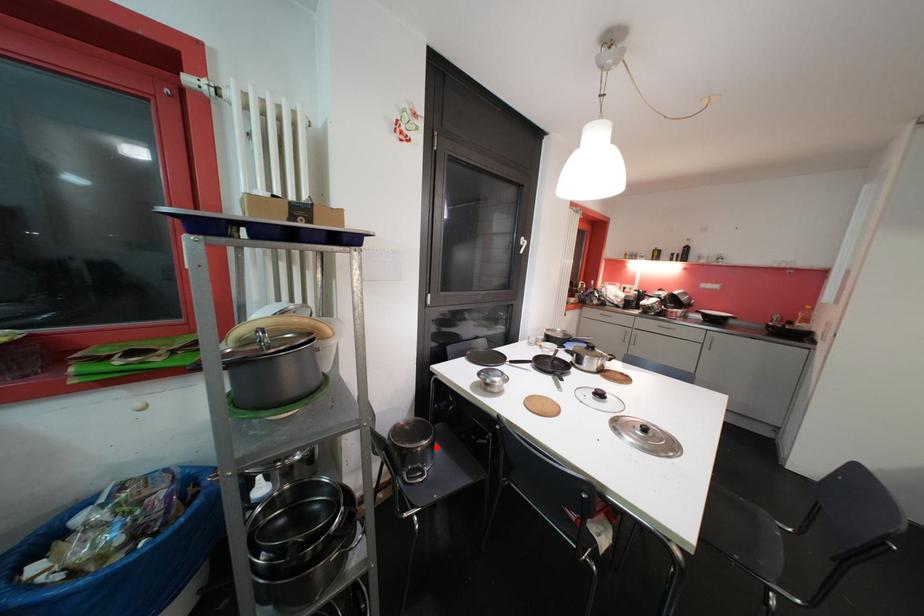
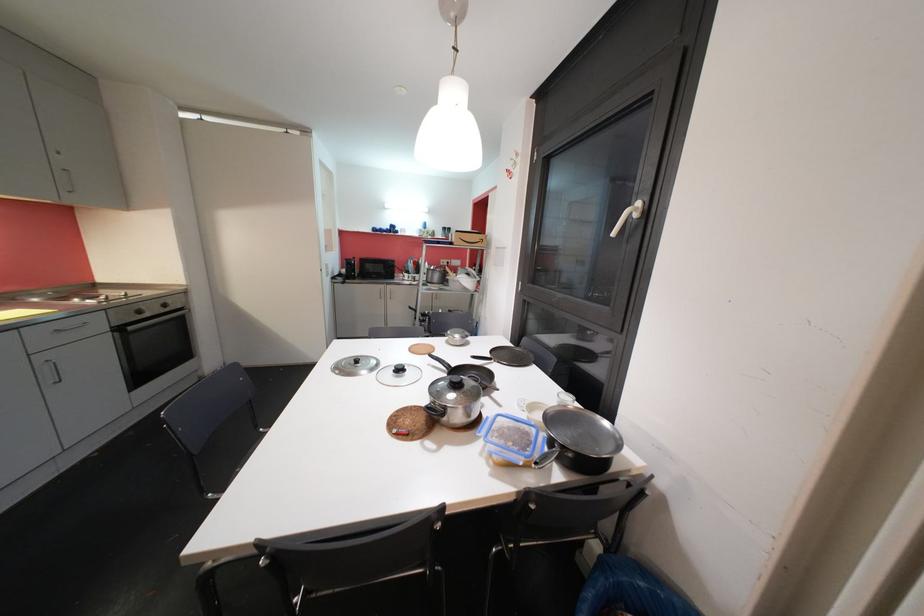
Question: I am providing you with two images of the same scene from different viewpoints. A red point is marked on the first image. Can you still see the location of the red point in image 2?

Choices:
 (A) Yes
 (B) No

Answer: (B)